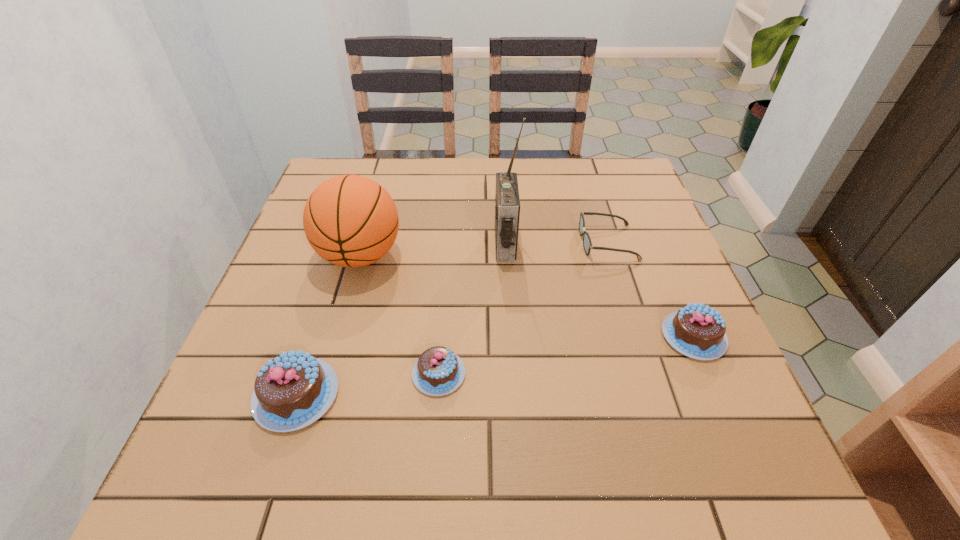
Locate an element on the screen. This screenshot has height=540, width=960. blank area located on the right of the leftmost chocolate cake is located at coordinates (456, 395).

The height and width of the screenshot is (540, 960). I want to click on vacant space located 0.130m on the back of the shortest chocolate cake, so click(444, 301).

In order to click on free region located on the back of the second shortest chocolate cake in this screenshot , I will do `click(654, 244)`.

Locate an element on the screen. Image resolution: width=960 pixels, height=540 pixels. free space located 0.170m on the back of the basketball is located at coordinates (379, 191).

Identify the location of vacant space situated 0.180m on the display of the fourth object from left to right. Image resolution: width=960 pixels, height=540 pixels. (421, 244).

This screenshot has height=540, width=960. Find the location of `vacant area situated 0.070m on the display of the fourth object from left to right`. vacant area situated 0.070m on the display of the fourth object from left to right is located at coordinates (466, 244).

Find the location of a particular element. The height and width of the screenshot is (540, 960). free point located 0.210m on the display of the fourth object from left to right is located at coordinates (409, 244).

Locate an element on the screen. Image resolution: width=960 pixels, height=540 pixels. vacant space situated on the face of the spectacles is located at coordinates (499, 242).

Identify the location of free space located on the face of the spectacles. This screenshot has width=960, height=540. (540, 242).

Locate an element on the screen. This screenshot has width=960, height=540. free space located 0.210m on the face of the spectacles is located at coordinates (495, 242).